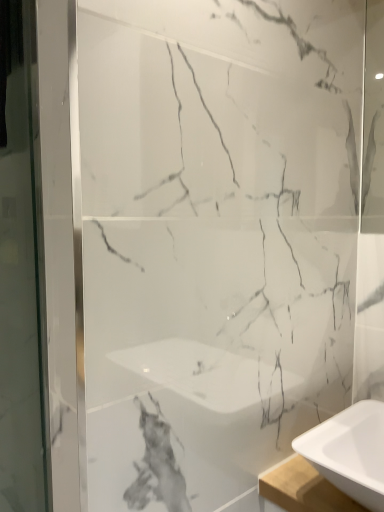
Question: Does transparent glass screen door at left touch white glossy sink at lower right?

Choices:
 (A) yes
 (B) no

Answer: (B)

Question: Does transparent glass screen door at left have a greater width compared to white glossy sink at lower right?

Choices:
 (A) no
 (B) yes

Answer: (A)

Question: Could white glossy sink at lower right be considered to be inside transparent glass screen door at left?

Choices:
 (A) no
 (B) yes

Answer: (A)

Question: From a real-world perspective, is transparent glass screen door at left on white glossy sink at lower right?

Choices:
 (A) no
 (B) yes

Answer: (B)

Question: Can you confirm if transparent glass screen door at left is positioned to the left of white glossy sink at lower right?

Choices:
 (A) yes
 (B) no

Answer: (A)

Question: From the image's perspective, would you say transparent glass screen door at left is shown under white glossy sink at lower right?

Choices:
 (A) no
 (B) yes

Answer: (A)

Question: From the image's perspective, is white glossy sink at lower right on top of transparent glass screen door at left?

Choices:
 (A) no
 (B) yes

Answer: (A)

Question: Is the depth of white glossy sink at lower right greater than that of transparent glass screen door at left?

Choices:
 (A) yes
 (B) no

Answer: (A)

Question: Considering the relative positions of white glossy sink at lower right and transparent glass screen door at left in the image provided, is white glossy sink at lower right to the left of transparent glass screen door at left from the viewer's perspective?

Choices:
 (A) no
 (B) yes

Answer: (A)

Question: Could you tell me if white glossy sink at lower right is facing transparent glass screen door at left?

Choices:
 (A) no
 (B) yes

Answer: (A)

Question: From the image's perspective, does white glossy sink at lower right appear lower than transparent glass screen door at left?

Choices:
 (A) yes
 (B) no

Answer: (A)

Question: Does white glossy sink at lower right have a smaller size compared to transparent glass screen door at left?

Choices:
 (A) yes
 (B) no

Answer: (A)

Question: Is transparent glass screen door at left inside the boundaries of white glossy sink at lower right, or outside?

Choices:
 (A) outside
 (B) inside

Answer: (A)